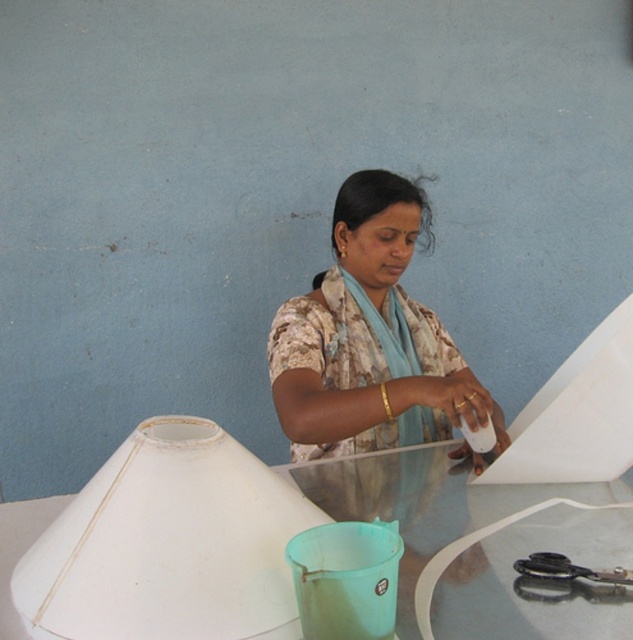
Question: Which object appears farthest from the camera in this image?

Choices:
 (A) black plastic scissors at lower right
 (B) matte floral shirt at center

Answer: (B)

Question: Which point is farther to the camera?

Choices:
 (A) (611, 584)
 (B) (385, 480)

Answer: (B)

Question: Among these objects, which one is farthest from the camera?

Choices:
 (A) transparent glass table at center
 (B) matte floral shirt at center
 (C) black plastic scissors at lower right

Answer: (B)

Question: Does matte floral shirt at center have a larger size compared to transparent glass table at center?

Choices:
 (A) yes
 (B) no

Answer: (A)

Question: Does matte floral shirt at center lie behind transparent glass table at center?

Choices:
 (A) yes
 (B) no

Answer: (A)

Question: Is matte floral shirt at center positioned behind black plastic scissors at lower right?

Choices:
 (A) yes
 (B) no

Answer: (A)